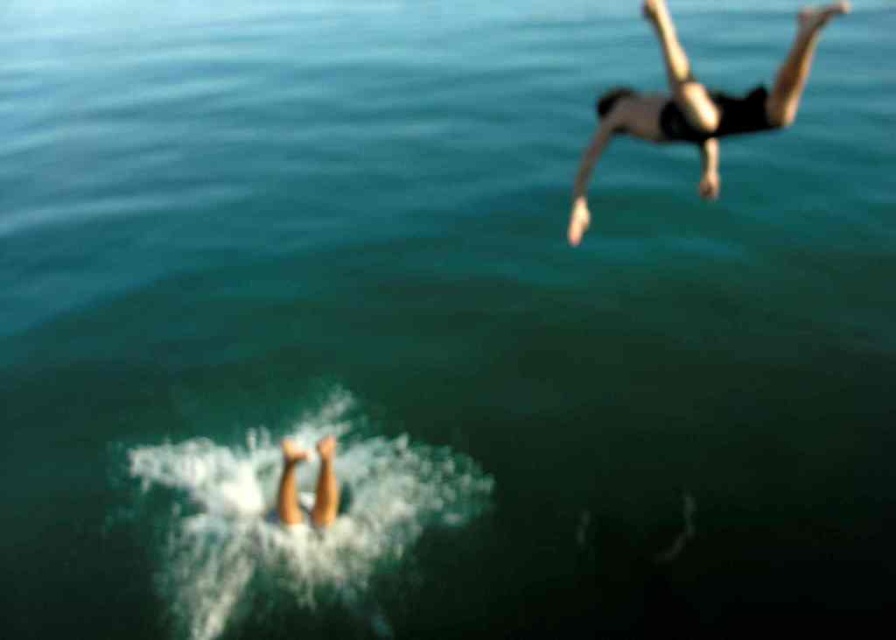
Question: Does black matte diver at upper right have a lesser width compared to skinny white legs at lower center?

Choices:
 (A) no
 (B) yes

Answer: (B)

Question: Which of the following is the farthest from the observer?

Choices:
 (A) black matte diver at upper right
 (B) skinny white legs at lower center

Answer: (A)

Question: Can you confirm if black matte diver at upper right is positioned above skinny white legs at lower center?

Choices:
 (A) yes
 (B) no

Answer: (A)

Question: Which object appears farthest from the camera in this image?

Choices:
 (A) skinny white legs at lower center
 (B) black matte diver at upper right

Answer: (B)

Question: Can you confirm if black matte diver at upper right is bigger than skinny white legs at lower center?

Choices:
 (A) no
 (B) yes

Answer: (A)